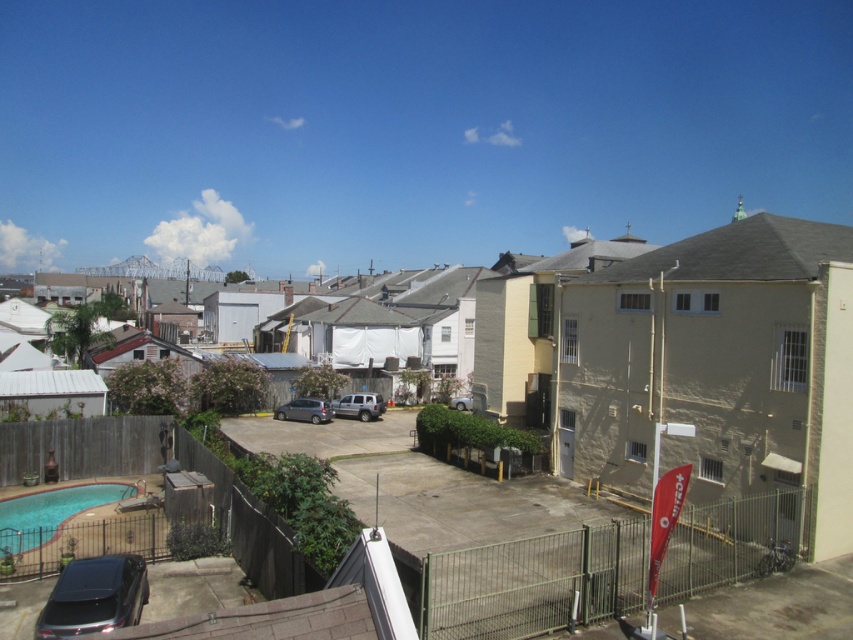
You are a delivery person trying to park your vehicle in the parking lot. You see the shiny black suv at lower left and the matte silver suv at center. Which vehicle is positioned lower in the parking lot?

The shiny black suv at lower left is positioned lower in the parking lot than the matte silver suv at center.

You are a delivery person trying to park your vehicle in the parking lot. You need to know if the blue smooth pool at lower left is taller than the matte silver suv at center to decide where to park. Based on the scene, what can you tell me?

The blue smooth pool at lower left is not as tall as the matte silver suv at center, so the pool is shorter. Therefore, the matte silver suv at center is taller than the pool, which means you can park near the pool without worrying about height restrictions related to this comparison.